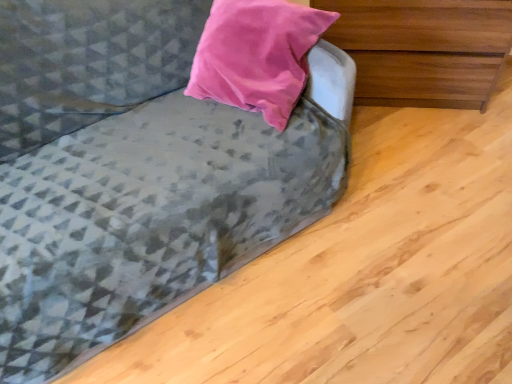
I want to click on textured gray fabric couch at upper left, so click(x=131, y=176).

Describe the element at coordinates (131, 176) in the screenshot. Image resolution: width=512 pixels, height=384 pixels. I see `textured gray fabric couch at upper left` at that location.

What do you see at coordinates (423, 49) in the screenshot? The image size is (512, 384). I see `wooden chest of drawers at upper right` at bounding box center [423, 49].

The height and width of the screenshot is (384, 512). What are the coordinates of `wooden chest of drawers at upper right` in the screenshot? It's located at (423, 49).

Where is `textured gray fabric couch at upper left`? The image size is (512, 384). textured gray fabric couch at upper left is located at coordinates (131, 176).

Considering the positions of objects wooden chest of drawers at upper right and textured gray fabric couch at upper left in the image provided, who is more to the right, wooden chest of drawers at upper right or textured gray fabric couch at upper left?

Positioned to the right is wooden chest of drawers at upper right.

Between wooden chest of drawers at upper right and textured gray fabric couch at upper left, which one is positioned behind?

wooden chest of drawers at upper right is further away from the camera.

Does point (429, 15) appear closer or farther from the camera than point (141, 278)?

Point (429, 15) is farther from the camera than point (141, 278).

From the image's perspective, is wooden chest of drawers at upper right below textured gray fabric couch at upper left?

Actually, wooden chest of drawers at upper right appears above textured gray fabric couch at upper left in the image.

From a real-world perspective, is wooden chest of drawers at upper right above or below textured gray fabric couch at upper left?

From a real-world perspective, wooden chest of drawers at upper right is physically below textured gray fabric couch at upper left.

From the picture: Does wooden chest of drawers at upper right have a greater width compared to textured gray fabric couch at upper left?

No, wooden chest of drawers at upper right is not wider than textured gray fabric couch at upper left.

Between wooden chest of drawers at upper right and textured gray fabric couch at upper left, which one has less height?

Standing shorter between the two is wooden chest of drawers at upper right.

Can you confirm if wooden chest of drawers at upper right is smaller than textured gray fabric couch at upper left?

Indeed, wooden chest of drawers at upper right has a smaller size compared to textured gray fabric couch at upper left.

Is textured gray fabric couch at upper left located within wooden chest of drawers at upper right?

No, textured gray fabric couch at upper left is not surrounded by wooden chest of drawers at upper right.

Are wooden chest of drawers at upper right and textured gray fabric couch at upper left far apart?

No, wooden chest of drawers at upper right is not far from textured gray fabric couch at upper left.

Could you tell me if wooden chest of drawers at upper right is facing textured gray fabric couch at upper left?

No, wooden chest of drawers at upper right is not facing towards textured gray fabric couch at upper left.

What's the angular difference between wooden chest of drawers at upper right and textured gray fabric couch at upper left's facing directions?

The facing directions of wooden chest of drawers at upper right and textured gray fabric couch at upper left are 42.8 degrees apart.

How far apart are wooden chest of drawers at upper right and textured gray fabric couch at upper left?

34.63 inches.

Where is `studio couch in front of the wooden chest of drawers at upper right`? studio couch in front of the wooden chest of drawers at upper right is located at coordinates (131, 176).

Does textured gray fabric couch at upper left appear on the right side of wooden chest of drawers at upper right?

Incorrect, textured gray fabric couch at upper left is not on the right side of wooden chest of drawers at upper right.

Is textured gray fabric couch at upper left in front of wooden chest of drawers at upper right?

Yes, it is.

Is point (164, 298) positioned before point (385, 4)?

Yes.

From the image's perspective, is textured gray fabric couch at upper left positioned above or below wooden chest of drawers at upper right?

From the image's perspective, textured gray fabric couch at upper left appears below wooden chest of drawers at upper right.

From a real-world perspective, relative to wooden chest of drawers at upper right, is textured gray fabric couch at upper left vertically above or below?

Clearly, from a real-world perspective, textured gray fabric couch at upper left is above wooden chest of drawers at upper right.

Which object is wider, textured gray fabric couch at upper left or wooden chest of drawers at upper right?

textured gray fabric couch at upper left.

Who is shorter, textured gray fabric couch at upper left or wooden chest of drawers at upper right?

wooden chest of drawers at upper right.

Who is bigger, textured gray fabric couch at upper left or wooden chest of drawers at upper right?

textured gray fabric couch at upper left.

Is textured gray fabric couch at upper left located outside wooden chest of drawers at upper right?

Yes, textured gray fabric couch at upper left is not within wooden chest of drawers at upper right.

Are textured gray fabric couch at upper left and wooden chest of drawers at upper right far apart?

No, textured gray fabric couch at upper left is not far from wooden chest of drawers at upper right.

Is textured gray fabric couch at upper left oriented towards wooden chest of drawers at upper right?

No.

How different are the orientations of textured gray fabric couch at upper left and wooden chest of drawers at upper right in degrees?

42.8 degrees separate the facing orientations of textured gray fabric couch at upper left and wooden chest of drawers at upper right.

Measure the distance from textured gray fabric couch at upper left to wooden chest of drawers at upper right.

34.63 inches.

Image resolution: width=512 pixels, height=384 pixels. Identify the location of studio couch in front of the wooden chest of drawers at upper right. (131, 176).

Identify the location of studio couch in front of the wooden chest of drawers at upper right. (131, 176).

At what (x,y) coordinates should I click in order to perform the action: click on chest of drawers below the textured gray fabric couch at upper left (from a real-world perspective). Please return your answer as a coordinate pair (x, y). The width and height of the screenshot is (512, 384). Looking at the image, I should click on (423, 49).